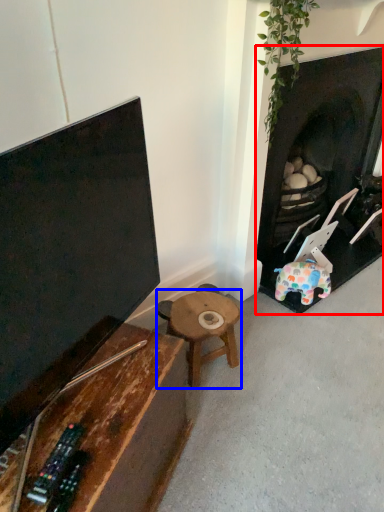
Question: Which object appears closest to the camera in this image, fireplace (highlighted by a red box) or table (highlighted by a blue box)?

Choices:
 (A) fireplace
 (B) table

Answer: (A)